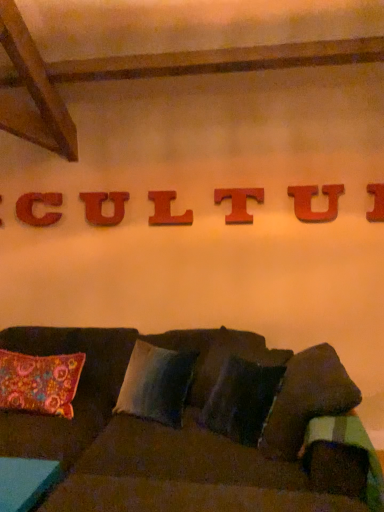
Question: Is dark fabric couch at center situated inside wooden letter t at center, which appears as the 3th letter when viewed from the right, or outside?

Choices:
 (A) outside
 (B) inside

Answer: (A)

Question: Relative to wooden letter t at center, which appears as the 3th letter when viewed from the right, is dark fabric couch at center in front or behind?

Choices:
 (A) behind
 (B) front

Answer: (B)

Question: Estimate the real-world distances between objects in this image. Which object is closer to the velvety blue pillow at center, which ranks as the second pillow in left-to-right order?

Choices:
 (A) floral fabric pillow at left, which ranks as the 2th pillow in right-to-left order
 (B) wooden letter l at center, which ranks as the 4th letter in right-to-left order
 (C) wooden letter i at upper center, which is the 1th letter in right-to-left order
 (D) wooden letter t at center, which is the 5th letter in left-to-right order
 (E) wooden letter c at upper center, acting as the 2th letter starting from the left

Answer: (A)

Question: Estimate the real-world distances between objects in this image. Which object is farther from the wooden letter u at center, which is the third letter in left-to-right order?

Choices:
 (A) floral fabric pillow at left, the 1th pillow viewed from the left
 (B) wooden letter at upper center, which ranks as the seventh letter in right-to-left order
 (C) wooden letter u at upper center, marked as the second letter in a right-to-left arrangement
 (D) velvety blue pillow at center, which ranks as the second pillow in left-to-right order
 (E) dark fabric couch at center

Answer: (E)